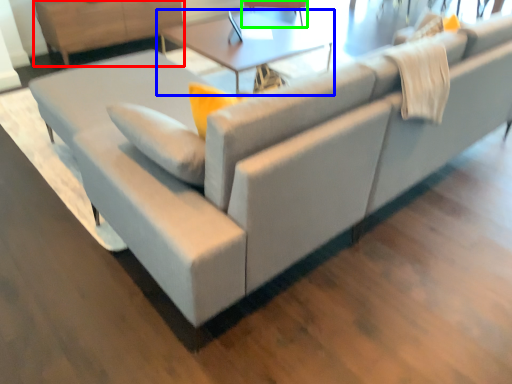
Question: Which is farther away from dresser (highlighted by a red box)? table (highlighted by a blue box) or swivel chair (highlighted by a green box)?

Choices:
 (A) table
 (B) swivel chair

Answer: (B)